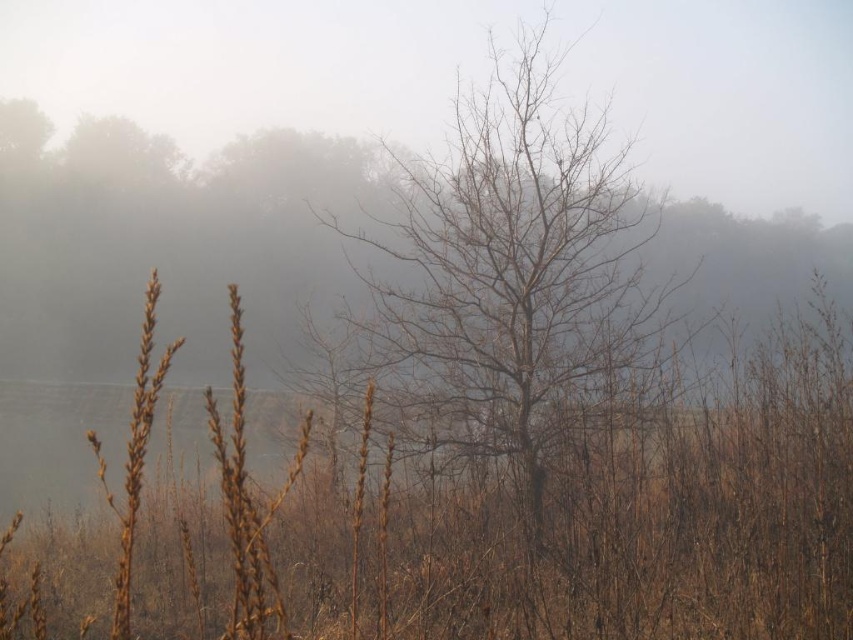
Question: Is the position of brown dry grass at center less distant than that of bare branches at center?

Choices:
 (A) no
 (B) yes

Answer: (B)

Question: Can you confirm if brown dry grass at center is positioned above bare branches at center?

Choices:
 (A) no
 (B) yes

Answer: (A)

Question: Does brown dry grass at center have a larger size compared to bare branches at center?

Choices:
 (A) yes
 (B) no

Answer: (B)

Question: Which point is closer to the camera?

Choices:
 (A) bare branches at center
 (B) brown dry grass at center

Answer: (B)